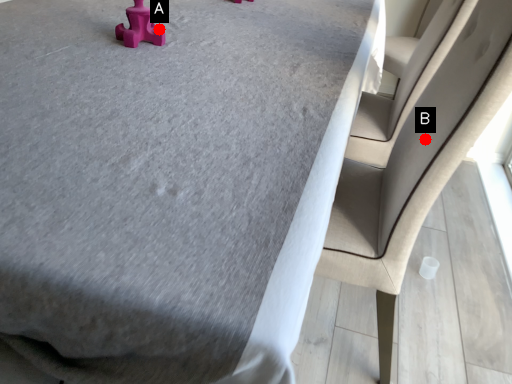
Question: Two points are circled on the image, labeled by A and B beside each circle. Which of the following is the farthest from the observer?

Choices:
 (A) A is further
 (B) B is further

Answer: (A)